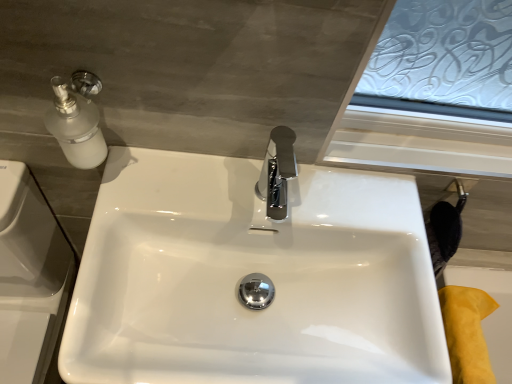
Question: From a real-world perspective, is yellow suede bath at lower right positioned above or below white glossy sink at center?

Choices:
 (A) below
 (B) above

Answer: (A)

Question: Visually, is yellow suede bath at lower right positioned to the left or to the right of white glossy sink at center?

Choices:
 (A) right
 (B) left

Answer: (A)

Question: From their relative heights in the image, would you say yellow suede bath at lower right is taller or shorter than white glossy sink at center?

Choices:
 (A) short
 (B) tall

Answer: (A)

Question: Is point (124, 314) positioned closer to the camera than point (500, 342)?

Choices:
 (A) closer
 (B) farther

Answer: (A)

Question: In the image, is white glossy sink at center positioned in front of or behind yellow suede bath at lower right?

Choices:
 (A) front
 (B) behind

Answer: (A)

Question: From the image's perspective, is white glossy sink at center above or below yellow suede bath at lower right?

Choices:
 (A) above
 (B) below

Answer: (A)

Question: From a real-world perspective, relative to yellow suede bath at lower right, is white glossy sink at center vertically above or below?

Choices:
 (A) above
 (B) below

Answer: (A)